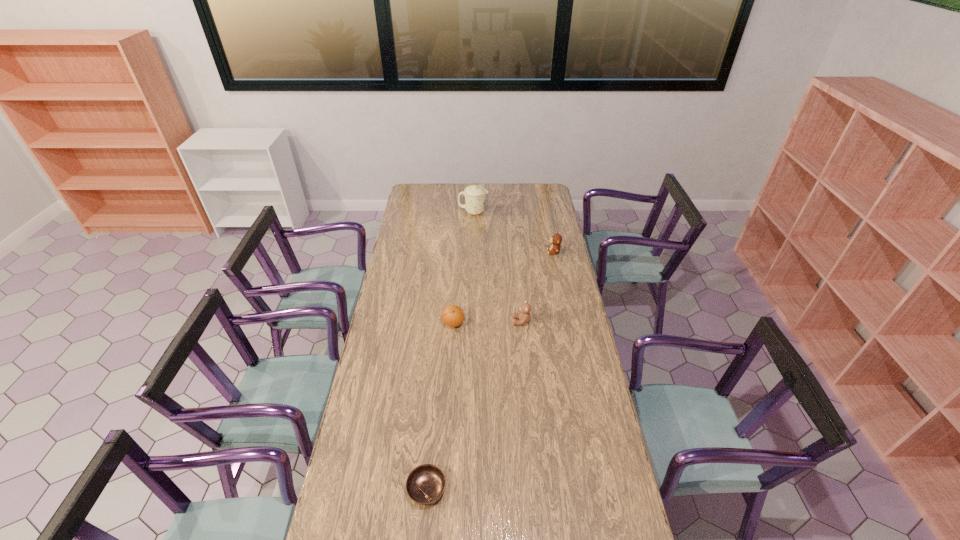
At what (x,y) coordinates should I click in order to perform the action: click on the tallest object. Please return your answer as a coordinate pair (x, y). The image size is (960, 540). Looking at the image, I should click on (475, 195).

At what (x,y) coordinates should I click in order to perform the action: click on the farthest object. Please return your answer as a coordinate pair (x, y). Looking at the image, I should click on (475, 195).

This screenshot has width=960, height=540. Identify the location of the farther teddy bear. (556, 240).

Where is `the rightmost object`? the rightmost object is located at coordinates (556, 240).

Locate an element on the screen. This screenshot has height=540, width=960. the second object from right to left is located at coordinates (524, 316).

This screenshot has width=960, height=540. Find the location of `the nearer teddy bear`. the nearer teddy bear is located at coordinates (524, 316).

This screenshot has height=540, width=960. What are the coordinates of `orange` in the screenshot? It's located at (452, 315).

Where is `the shortest object`? This screenshot has height=540, width=960. the shortest object is located at coordinates (425, 484).

Locate an element on the screen. the nearest object is located at coordinates (425, 484).

This screenshot has width=960, height=540. Identify the location of vacant region located on the spout of the tallest object. (535, 212).